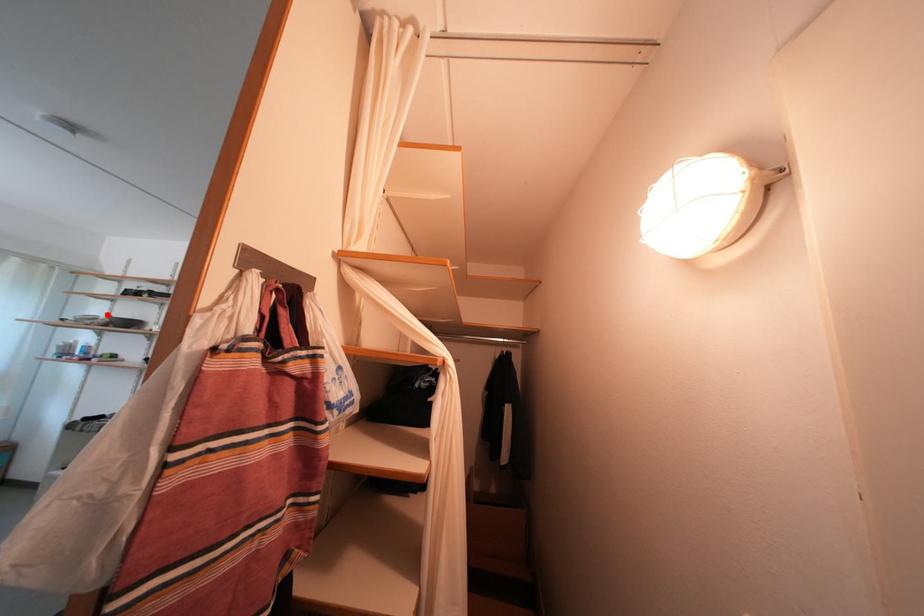
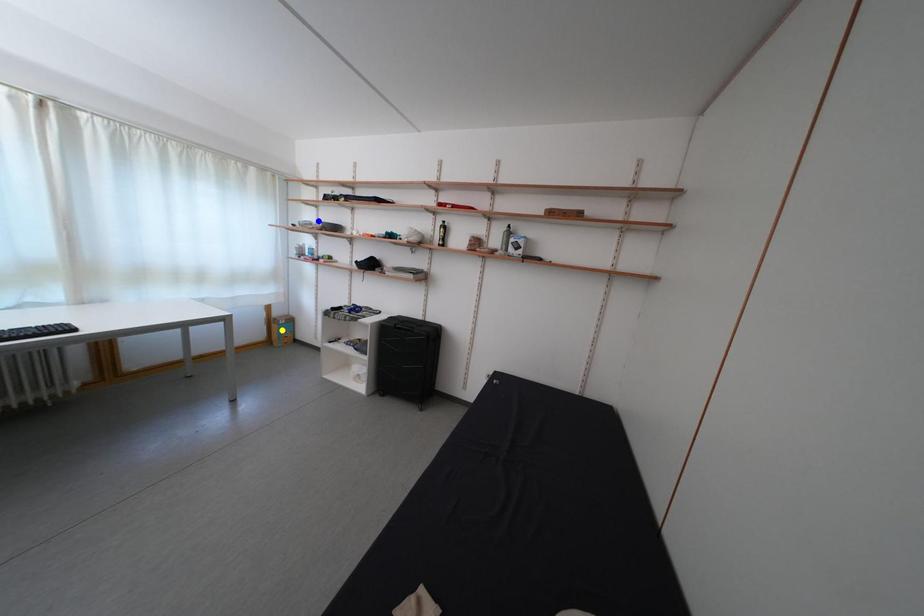
Question: I am providing you with two images of the same scene from different viewpoints. A red point is marked on the first image. You are given multiple points on the second image. Which point in image 2 represents the same 3d spot as the red point in image 1?

Choices:
 (A) green point
 (B) yellow point
 (C) blue point

Answer: (C)